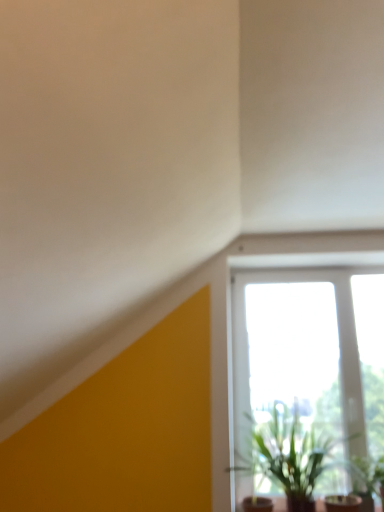
Question: Is transparent glass window at center at the back of green leafy plant at lower right, the 2th houseplant from the left?

Choices:
 (A) no
 (B) yes

Answer: (B)

Question: From a real-world perspective, is green leafy plant at lower right, the 2th houseplant from the left, over transparent glass window at center?

Choices:
 (A) yes
 (B) no

Answer: (B)

Question: Is green leafy plant at lower right, which is the first houseplant from right to left, thinner than transparent glass window at center?

Choices:
 (A) yes
 (B) no

Answer: (B)

Question: Can you confirm if green leafy plant at lower right, which is the first houseplant from right to left, is shorter than transparent glass window at center?

Choices:
 (A) yes
 (B) no

Answer: (A)

Question: Is green leafy plant at lower right, the 2th houseplant from the left, far away from transparent glass window at center?

Choices:
 (A) no
 (B) yes

Answer: (A)

Question: Choose the correct answer: Is green leafy plant at lower right, which is the first houseplant from right to left, inside transparent glass window at center or outside it?

Choices:
 (A) outside
 (B) inside

Answer: (A)

Question: From the image's perspective, is green leafy plant at lower right, which is the first houseplant from right to left, positioned above or below transparent glass window at center?

Choices:
 (A) below
 (B) above

Answer: (A)

Question: Looking at the image, does green leafy plant at lower right, the 2th houseplant from the left, seem bigger or smaller compared to transparent glass window at center?

Choices:
 (A) big
 (B) small

Answer: (B)

Question: From a real-world perspective, is green leafy plant at lower right, which is the first houseplant from right to left, above or below transparent glass window at center?

Choices:
 (A) above
 (B) below

Answer: (B)

Question: Is point (253, 458) positioned closer to the camera than point (372, 458)?

Choices:
 (A) closer
 (B) farther

Answer: (A)

Question: Looking at the image, does green leafy plant at lower right, the 1th houseplant from the left, seem bigger or smaller compared to green leafy plant at lower right, the 2th houseplant from the left?

Choices:
 (A) small
 (B) big

Answer: (B)

Question: Considering the relative positions of green leafy plant at lower right, the 1th houseplant from the left, and green leafy plant at lower right, which is the first houseplant from right to left, in the image provided, is green leafy plant at lower right, the 1th houseplant from the left, to the left or to the right of green leafy plant at lower right, which is the first houseplant from right to left,?

Choices:
 (A) left
 (B) right

Answer: (A)

Question: From a real-world perspective, relative to green leafy plant at lower right, which is the first houseplant from right to left, is green leafy plant at lower right, marked as the second houseplant in a right-to-left arrangement, vertically above or below?

Choices:
 (A) below
 (B) above

Answer: (B)

Question: From a real-world perspective, is transparent glass window at center above or below green leafy plant at lower right, the 2th houseplant from the left?

Choices:
 (A) above
 (B) below

Answer: (A)

Question: Looking at the image, does transparent glass window at center seem bigger or smaller compared to green leafy plant at lower right, which is the first houseplant from right to left?

Choices:
 (A) big
 (B) small

Answer: (A)